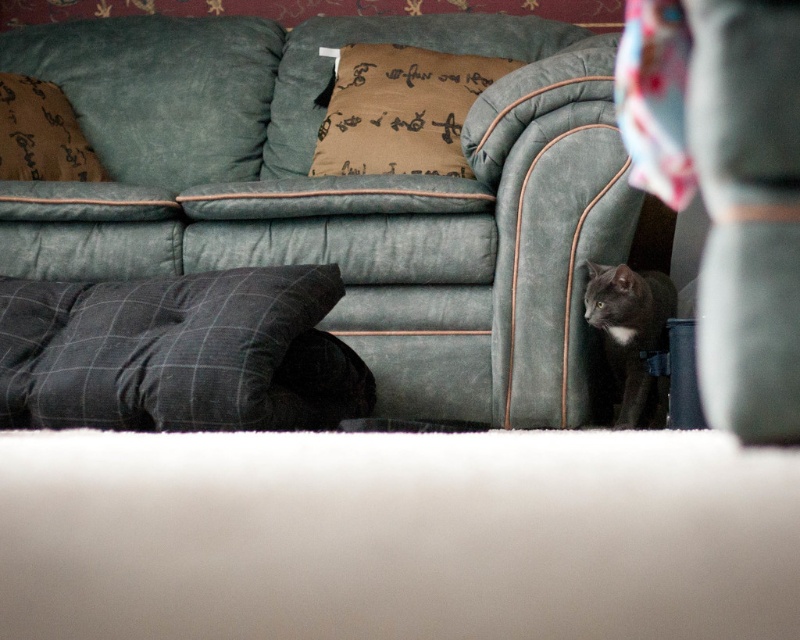
Does suede green couch at center have a larger size compared to gray checkered pillow at lower left?

Indeed, suede green couch at center has a larger size compared to gray checkered pillow at lower left.

Identify the location of suede green couch at center. (350, 195).

Is suede green couch at center bigger than suede-like gray cat at lower right?

Correct, suede green couch at center is larger in size than suede-like gray cat at lower right.

Can you confirm if suede green couch at center is positioned to the left of suede-like gray cat at lower right?

Yes, suede green couch at center is to the left of suede-like gray cat at lower right.

Image resolution: width=800 pixels, height=640 pixels. Find the location of `suede green couch at center`. suede green couch at center is located at coordinates (350, 195).

The width and height of the screenshot is (800, 640). I want to click on suede green couch at center, so click(x=350, y=195).

Who is more distant from viewer, (236, 211) or (32, 83)?

Point (32, 83)

Is point (494, 406) farther from camera compared to point (26, 164)?

No.

The width and height of the screenshot is (800, 640). I want to click on suede green couch at center, so click(350, 195).